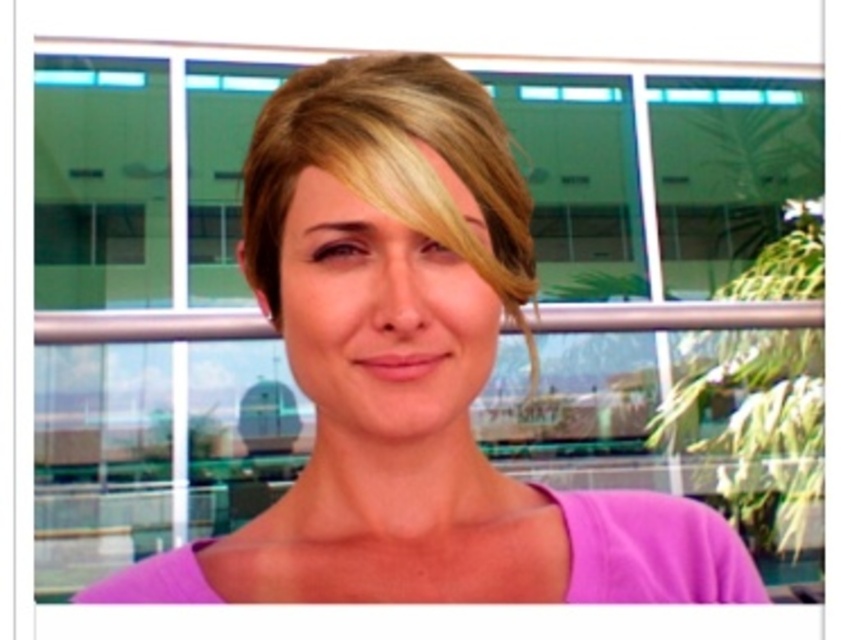
Question: Can you confirm if purple matte shirt at center is bigger than blonde shiny hair at center?

Choices:
 (A) no
 (B) yes

Answer: (B)

Question: Is purple matte shirt at center to the left of blonde shiny hair at center from the viewer's perspective?

Choices:
 (A) yes
 (B) no

Answer: (A)

Question: Can you confirm if purple matte shirt at center is positioned above blonde shiny hair at center?

Choices:
 (A) yes
 (B) no

Answer: (B)

Question: Among these points, which one is nearest to the camera?

Choices:
 (A) (459, 252)
 (B) (484, 248)

Answer: (A)

Question: Which object is farther from the camera taking this photo?

Choices:
 (A) blonde shiny hair at center
 (B) purple matte shirt at center

Answer: (A)